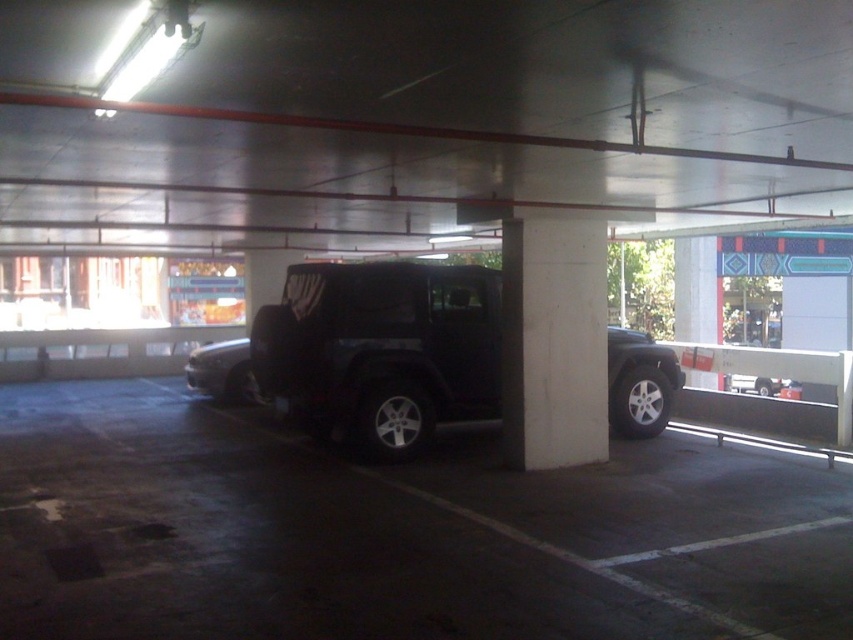
You are standing in the parking garage and want to reach a specific point marked as point (343, 605). If your current position is 10 feet away from that point, how much further do you need to walk to reach it?

The point (343, 605) is 17.01 feet away from the viewer. Since you are currently 10 feet away, you need to walk an additional 7.01 feet to reach it.

You are standing in the parking garage and want to reach the point marked at coordinates (396, 422). The parking space for the black SUV is 25 feet long. Can you determine if the point is within the parking space of the black SUV?

The point marked at coordinates (396, 422) is 31.08 feet from the viewer, which is beyond the 25 feet length of the parking space for the black SUV. Therefore, the point is outside the parking space.